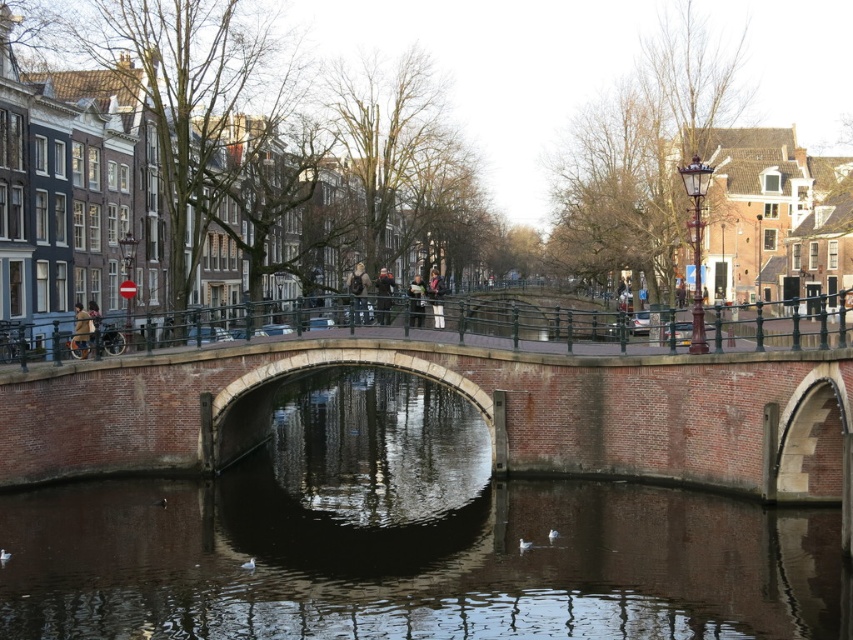
From the picture: Can you confirm if brick stone bridge at center is smaller than green metal railing at center?

Yes, brick stone bridge at center is smaller than green metal railing at center.

In the scene shown: Is brick stone bridge at center taller than green metal railing at center?

Yes, brick stone bridge at center is taller than green metal railing at center.

Which is behind, point (749, 420) or point (827, 310)?

Point (749, 420)

Image resolution: width=853 pixels, height=640 pixels. Find the location of `brick stone bridge at center`. brick stone bridge at center is located at coordinates (467, 400).